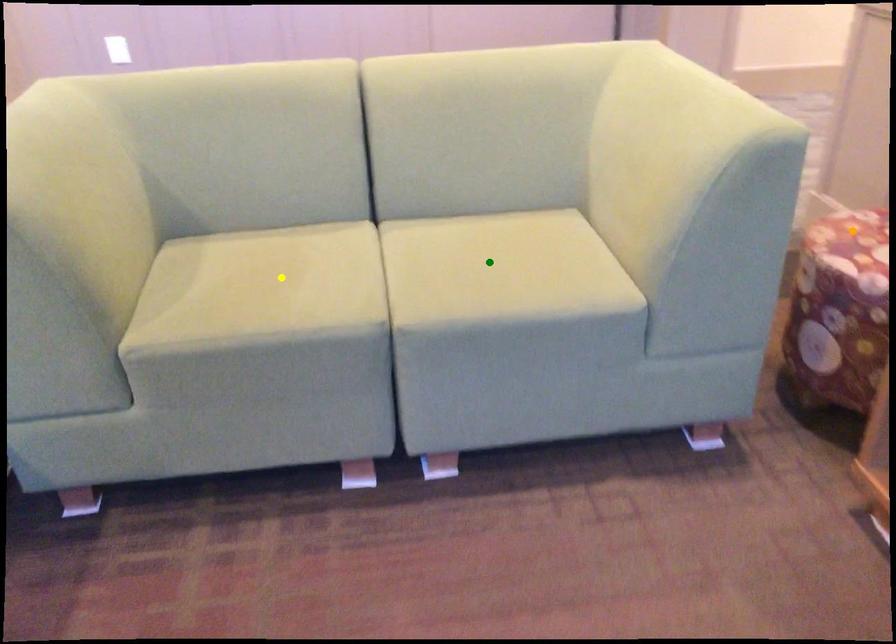
Order these from nearest to farthest:
green point
yellow point
orange point

yellow point, green point, orange point